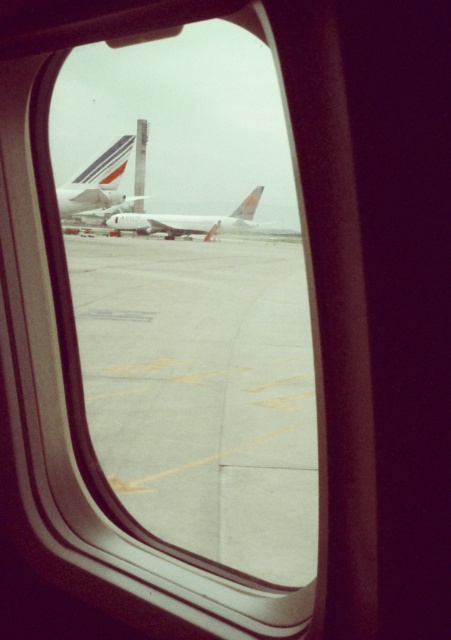
Can you confirm if concrete tarmac at center is shorter than white matte airplane at center?

No, concrete tarmac at center is not shorter than white matte airplane at center.

Is concrete tarmac at center positioned before white matte airplane at center?

That is True.

What are the coordinates of `concrete tarmac at center` in the screenshot? It's located at pyautogui.click(x=203, y=392).

Is concrete tarmac at center positioned behind white glossy airplane at center?

That is False.

How far apart are concrete tarmac at center and white glossy airplane at center?

The distance of concrete tarmac at center from white glossy airplane at center is 8.94 meters.

Is point (236, 438) farther from viewer compared to point (70, 179)?

No.

Identify the location of concrete tarmac at center. (203, 392).

Is point (106, 161) more distant than point (239, 228)?

No, (106, 161) is in front of (239, 228).

Who is lower down, white glossy airplane at center or white matte airplane at center?

white matte airplane at center is lower down.

Does point (132, 138) lie in front of point (127, 220)?

Yes, it is.

Locate an element on the screen. white glossy airplane at center is located at coordinates (97, 182).